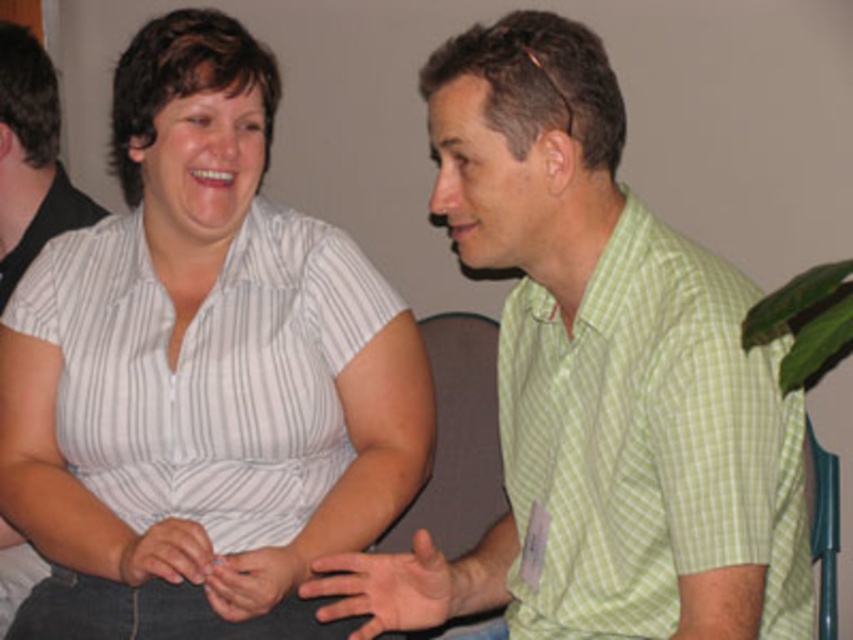
Question: Is green checkered shirt at center bigger than green checkered shirt at right?

Choices:
 (A) yes
 (B) no

Answer: (A)

Question: Does white striped shirt at center have a greater width compared to green checkered shirt at right?

Choices:
 (A) yes
 (B) no

Answer: (A)

Question: Where is green checkered shirt at right located in relation to black shirt at left in the image?

Choices:
 (A) left
 (B) right

Answer: (B)

Question: Based on their relative distances, which object is nearer to the white striped shirt at center?

Choices:
 (A) black shirt at left
 (B) green checkered shirt at right

Answer: (B)

Question: Considering the real-world distances, which object is farthest from the white striped shirt at center?

Choices:
 (A) black shirt at left
 (B) green checkered shirt at right
 (C) green checkered shirt at center

Answer: (A)

Question: Estimate the real-world distances between objects in this image. Which object is farther from the green checkered shirt at center?

Choices:
 (A) black shirt at left
 (B) green checkered shirt at right
 (C) white striped shirt at center

Answer: (A)